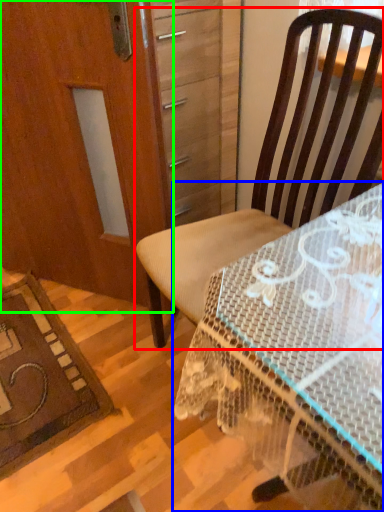
Question: Which is nearer to the chair (highlighted by a red box)? desk (highlighted by a blue box) or screen door (highlighted by a green box).

Choices:
 (A) desk
 (B) screen door

Answer: (A)